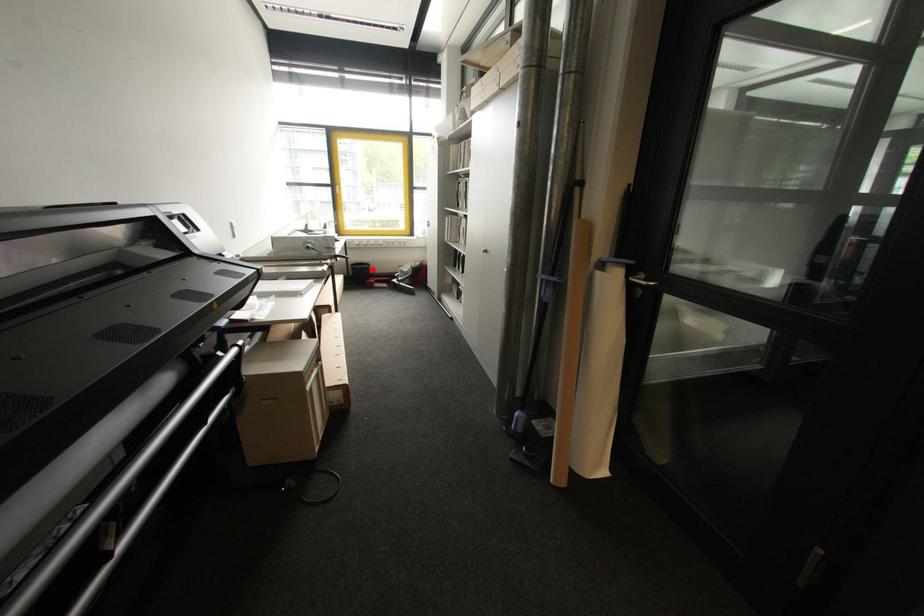
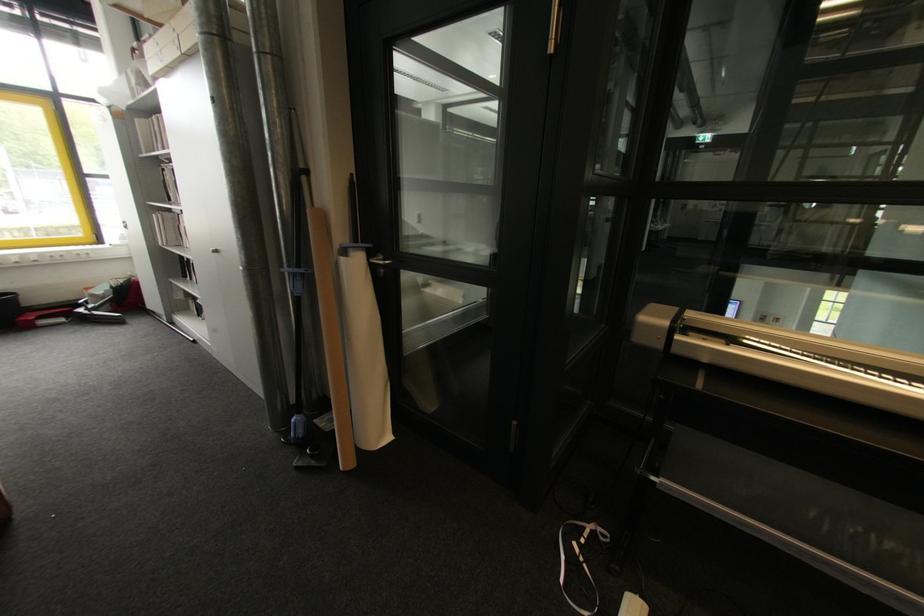
Question: I am providing you with two images of the same scene from different viewpoints. A red point is shown in image1. For the corresponding object point in image2, is it positioned nearer or farther from the camera?

Choices:
 (A) Nearer
 (B) Farther

Answer: (B)